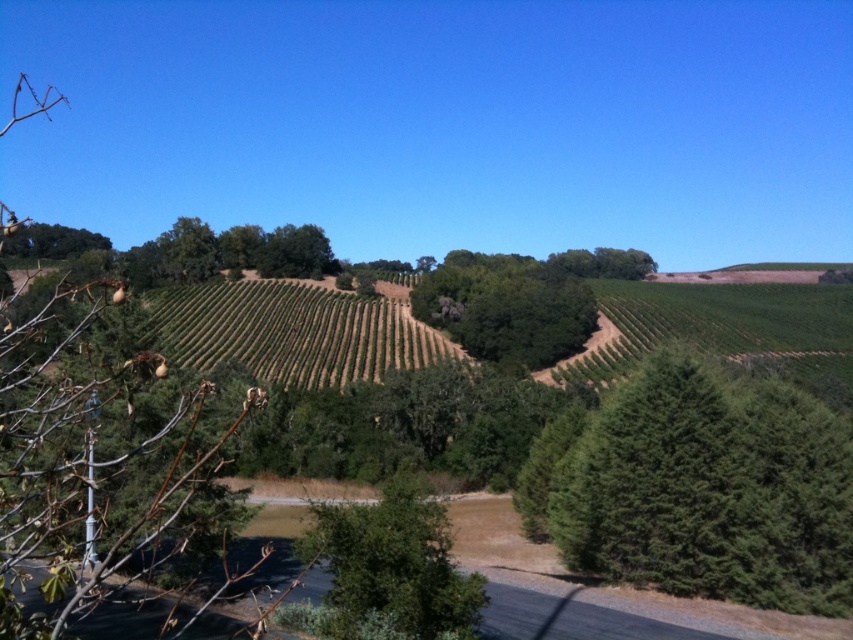
Question: Is green textured tree at center-right thinner than green leafy tree at center?

Choices:
 (A) no
 (B) yes

Answer: (A)

Question: Which of the following is the closest to the observer?

Choices:
 (A) (709, 372)
 (B) (431, 609)

Answer: (B)

Question: Is green textured tree at center-right to the right of green leafy tree at center from the viewer's perspective?

Choices:
 (A) no
 (B) yes

Answer: (B)

Question: Is green textured tree at center-right thinner than green leafy tree at center?

Choices:
 (A) yes
 (B) no

Answer: (B)